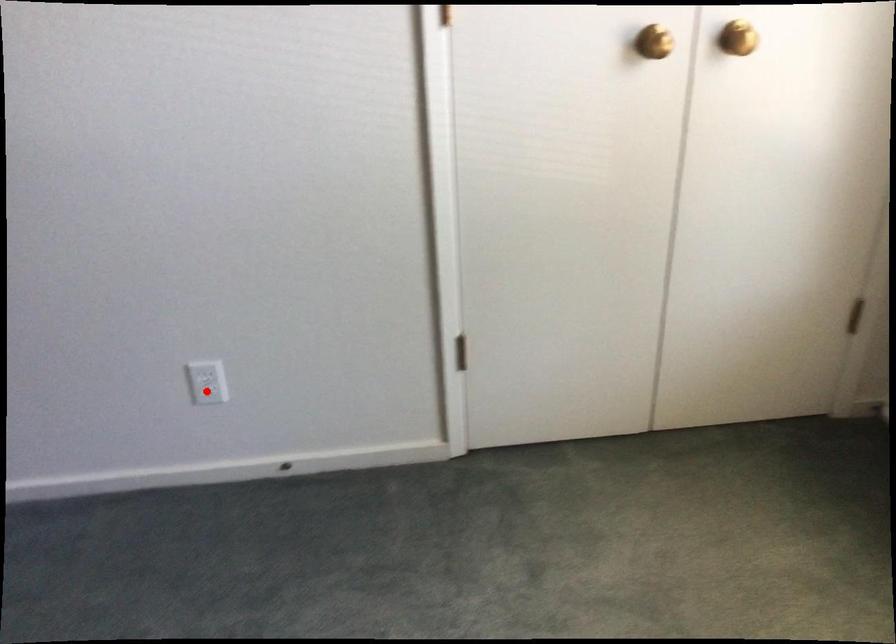
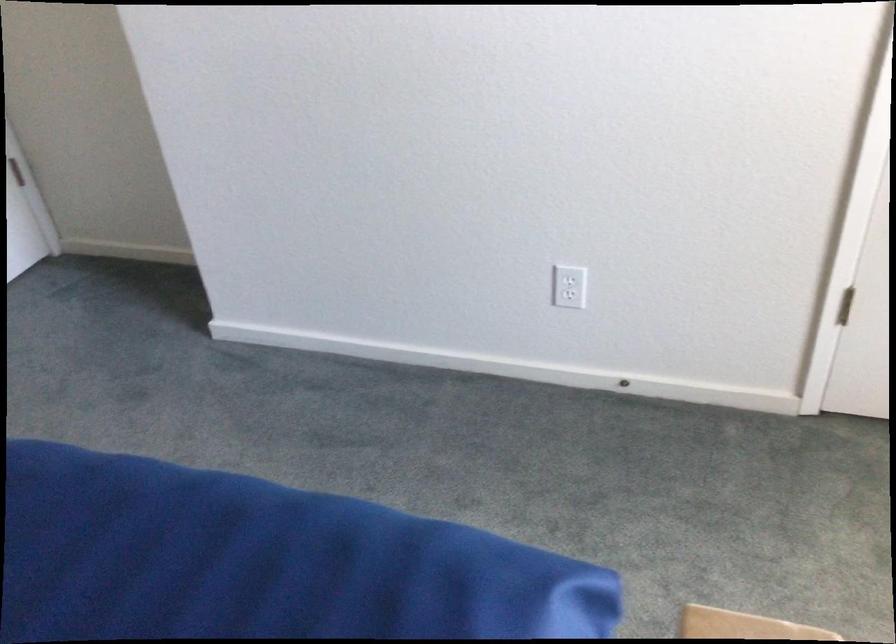
In the second image, find the point that corresponds to the highlighted location in the first image.

(569, 295)